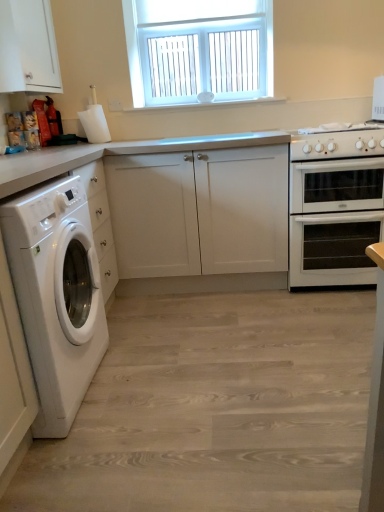
Question: Is white glossy washing machine at left further to the viewer compared to white matte cabinet at upper left, acting as the second cabinetry starting from the bottom?

Choices:
 (A) yes
 (B) no

Answer: (B)

Question: Does white glossy washing machine at left have a lesser height compared to white matte cabinet at upper left, which appears as the 1th cabinetry when viewed from the left?

Choices:
 (A) yes
 (B) no

Answer: (B)

Question: Considering the relative sizes of white glossy washing machine at left and white matte cabinet at upper left, positioned as the 2th cabinetry in right-to-left order, in the image provided, is white glossy washing machine at left smaller than white matte cabinet at upper left, positioned as the 2th cabinetry in right-to-left order,?

Choices:
 (A) no
 (B) yes

Answer: (A)

Question: Are white glossy washing machine at left and white matte cabinet at upper left, placed as the 1th cabinetry when sorted from top to bottom, beside each other?

Choices:
 (A) yes
 (B) no

Answer: (B)

Question: Is white matte cabinet at upper left, acting as the second cabinetry starting from the bottom, inside white glossy washing machine at left?

Choices:
 (A) yes
 (B) no

Answer: (B)

Question: Is white glossy washing machine at left completely or partially outside of white matte cabinet at upper left, which appears as the 1th cabinetry when viewed from the left?

Choices:
 (A) no
 (B) yes

Answer: (B)

Question: Is white glossy gas stove at right beside white glossy washing machine at left?

Choices:
 (A) yes
 (B) no

Answer: (B)

Question: Can you confirm if white glossy gas stove at right is positioned to the right of white glossy washing machine at left?

Choices:
 (A) yes
 (B) no

Answer: (A)

Question: From a real-world perspective, is white glossy gas stove at right located higher than white glossy washing machine at left?

Choices:
 (A) yes
 (B) no

Answer: (A)

Question: Does white glossy gas stove at right have a lesser height compared to white glossy washing machine at left?

Choices:
 (A) yes
 (B) no

Answer: (A)

Question: Is white glossy gas stove at right taller than white glossy washing machine at left?

Choices:
 (A) yes
 (B) no

Answer: (B)

Question: Is white glossy gas stove at right not near white glossy washing machine at left?

Choices:
 (A) no
 (B) yes

Answer: (B)

Question: Does white matte cabinet at left, which appears as the second cabinetry when viewed from the top, have a lesser height compared to white matte cabinet at upper left, acting as the second cabinetry starting from the bottom?

Choices:
 (A) yes
 (B) no

Answer: (B)